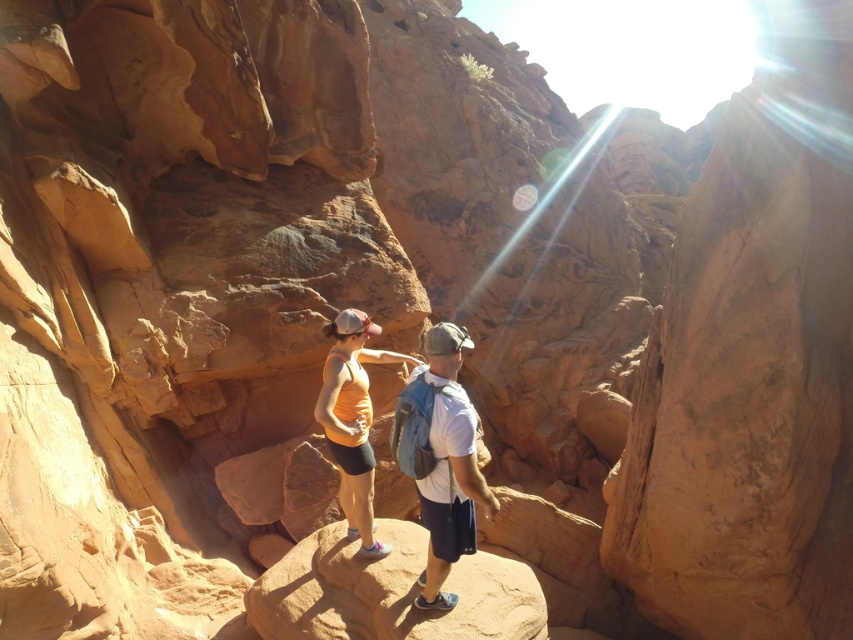
Is white matte shirt at center positioned before orange fabric tank top at center?

Yes, white matte shirt at center is in front of orange fabric tank top at center.

This screenshot has width=853, height=640. Describe the element at coordinates (448, 465) in the screenshot. I see `white matte shirt at center` at that location.

Identify the location of white matte shirt at center. The width and height of the screenshot is (853, 640). (448, 465).